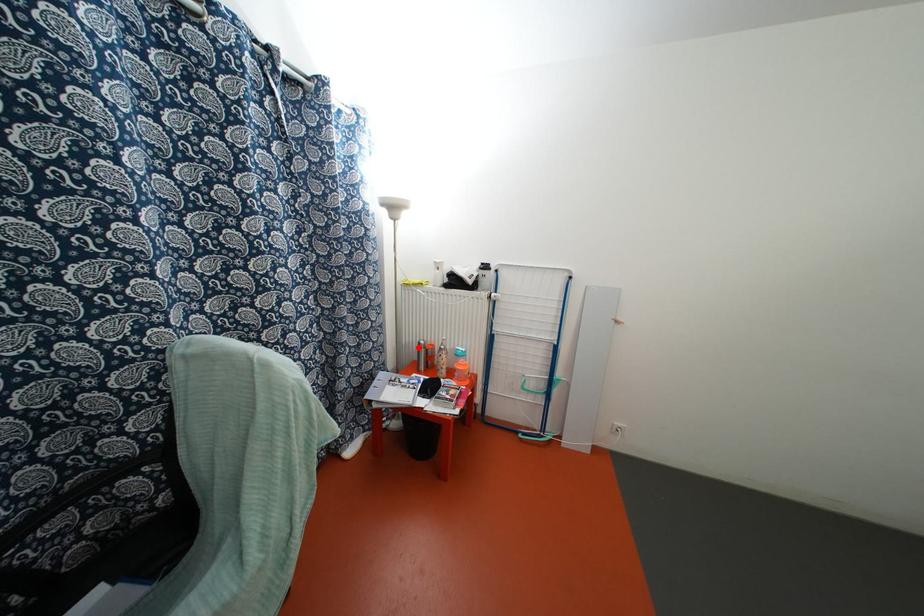
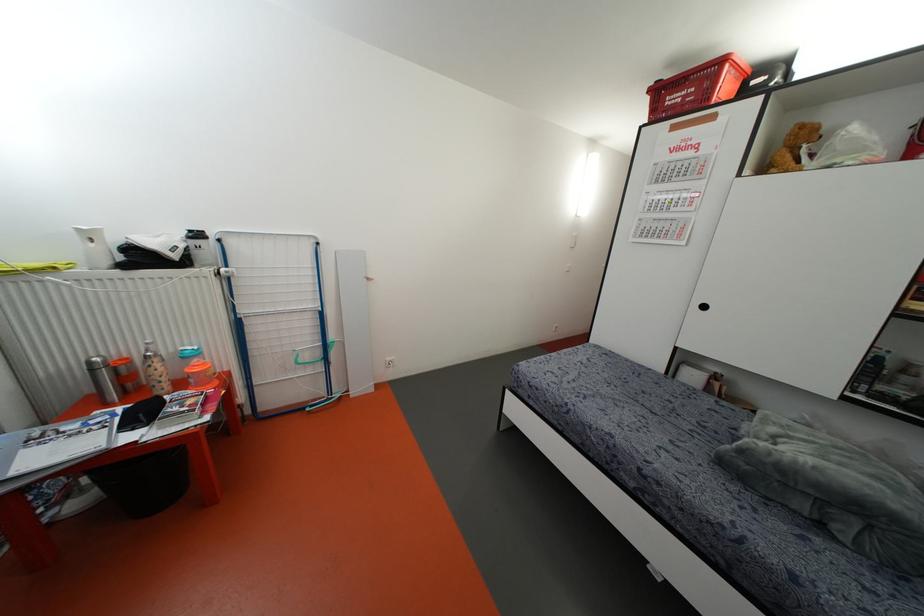
Question: I am providing you with two images of the same scene from different viewpoints. Image1 has a red point marked. In image2, the corresponding 3D location appears at what relative position? Reply with the corresponding letter.

Choices:
 (A) Closer
 (B) Farther

Answer: (A)